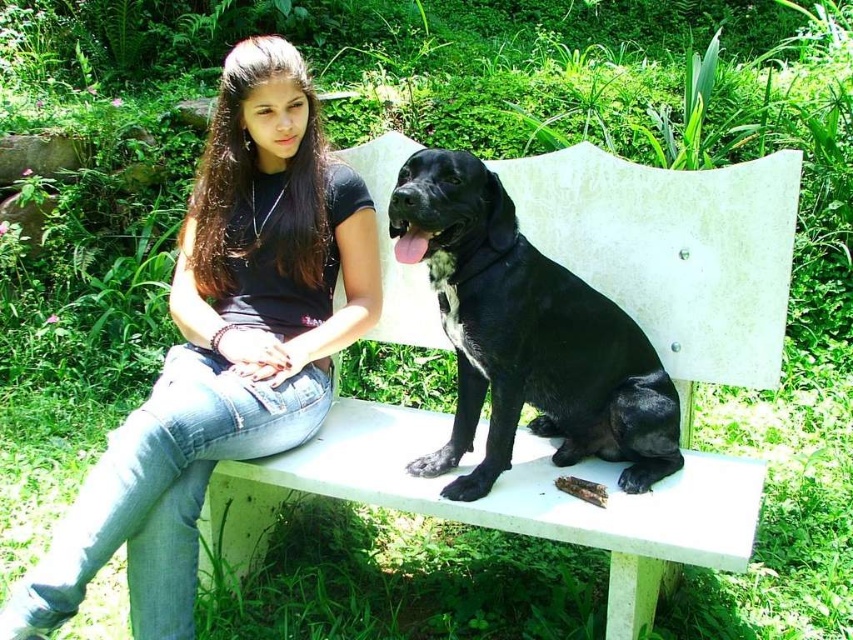
Question: Which is nearer to the white matte park bench at center?

Choices:
 (A) black matte shirt at upper center
 (B) black smooth dog at center

Answer: (B)

Question: Which object appears closest to the camera in this image?

Choices:
 (A) black matte shirt at upper center
 (B) black smooth dog at center

Answer: (B)

Question: Is white matte park bench at center bigger than black matte shirt at upper center?

Choices:
 (A) yes
 (B) no

Answer: (A)

Question: Is white matte park bench at center further to camera compared to black smooth dog at center?

Choices:
 (A) yes
 (B) no

Answer: (B)

Question: Which point appears farthest from the camera in this image?

Choices:
 (A) (497, 186)
 (B) (666, 176)

Answer: (B)

Question: Can you confirm if black matte shirt at upper center is bigger than black smooth dog at center?

Choices:
 (A) yes
 (B) no

Answer: (A)